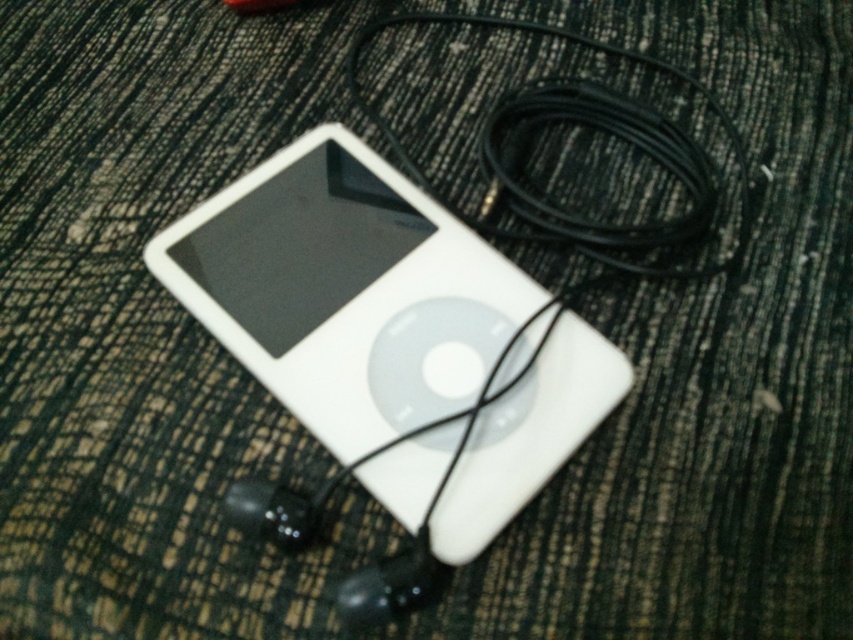
Question: Can you confirm if white matte ipod at center is bigger than black cable at upper right?

Choices:
 (A) yes
 (B) no

Answer: (A)

Question: Which of the following is the farthest from the observer?

Choices:
 (A) white matte ipod at center
 (B) black cable at upper right

Answer: (B)

Question: Which object appears farthest from the camera in this image?

Choices:
 (A) white matte ipod at center
 (B) black cable at upper right

Answer: (B)

Question: Can you confirm if white matte ipod at center is positioned below black cable at upper right?

Choices:
 (A) no
 (B) yes

Answer: (B)

Question: Does white matte ipod at center appear on the right side of black cable at upper right?

Choices:
 (A) yes
 (B) no

Answer: (B)